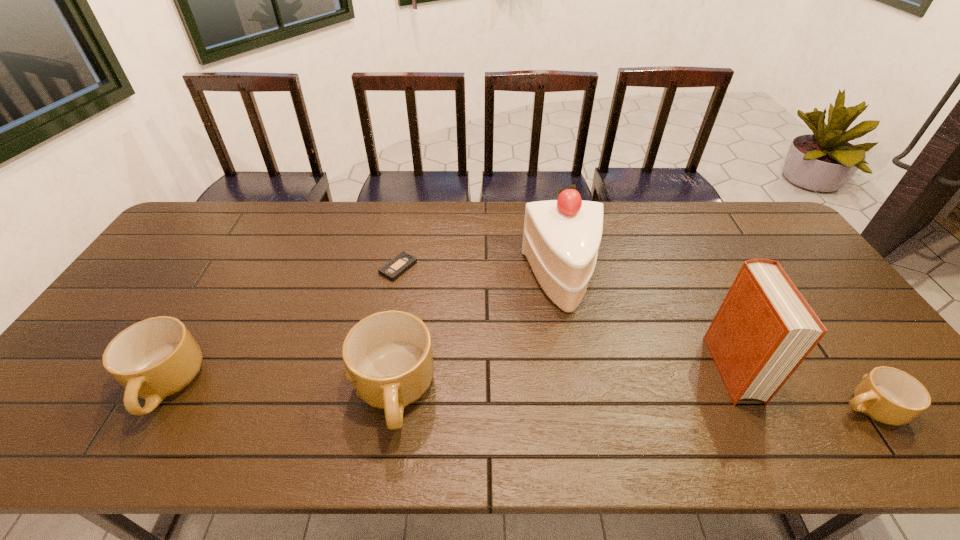
Locate an element on the screen. This screenshot has width=960, height=540. object that is the fourth closest to the second mug from right to left is located at coordinates (764, 329).

Identify which mug is the third nearest to the hardback book. Please provide its 2D coordinates. Your answer should be formatted as a tuple, i.e. [(x, y)], where the tuple contains the x and y coordinates of a point satisfying the conditions above.

[(157, 357)]

Where is `mug that stands as the closest to the shortest object`? The width and height of the screenshot is (960, 540). mug that stands as the closest to the shortest object is located at coordinates (388, 357).

In order to click on vacant region that satisfies the following two spatial constraints: 1. on the side with the handle of the leftmost object; 2. on the side with the handle of the rightmost object in this screenshot , I will do `click(153, 408)`.

Where is `free space that satisfies the following two spatial constraints: 1. on the side with the handle of the second mug from left to right; 2. on the side with the handle of the shortest mug`? free space that satisfies the following two spatial constraints: 1. on the side with the handle of the second mug from left to right; 2. on the side with the handle of the shortest mug is located at coordinates (392, 408).

Locate an element on the screen. Image resolution: width=960 pixels, height=540 pixels. vacant space that satisfies the following two spatial constraints: 1. on the side with the handle of the fifth tallest object; 2. on the side with the handle of the third shortest object is located at coordinates (853, 387).